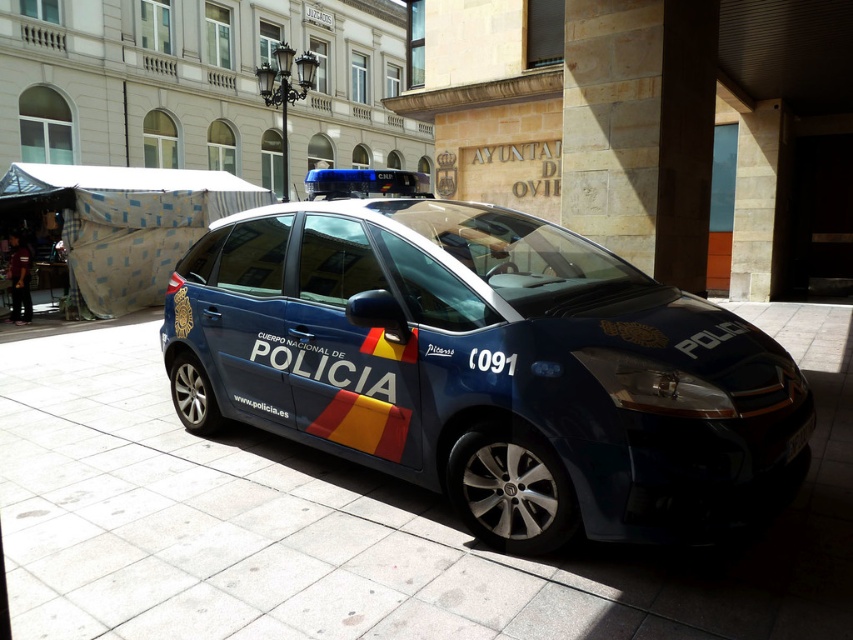
Between point (410, 300) and point (25, 454), which one is positioned in front?

Point (410, 300) is in front.

The height and width of the screenshot is (640, 853). What do you see at coordinates (485, 365) in the screenshot?
I see `glossy blue police car at center` at bounding box center [485, 365].

I want to click on glossy blue police car at center, so point(485,365).

Can you confirm if slate gray pavement at center is positioned below black plastic license plate at lower right?

Indeed, slate gray pavement at center is positioned under black plastic license plate at lower right.

This screenshot has height=640, width=853. What do you see at coordinates (358, 524) in the screenshot? I see `slate gray pavement at center` at bounding box center [358, 524].

The width and height of the screenshot is (853, 640). Identify the location of slate gray pavement at center. (358, 524).

Does glossy blue police car at center have a larger size compared to black plastic license plate at lower right?

Yes, glossy blue police car at center is bigger than black plastic license plate at lower right.

Does glossy blue police car at center appear under black plastic license plate at lower right?

No, glossy blue police car at center is not below black plastic license plate at lower right.

Which is behind, point (637, 532) or point (804, 428)?

Positioned behind is point (804, 428).

The image size is (853, 640). I want to click on glossy blue police car at center, so click(485, 365).